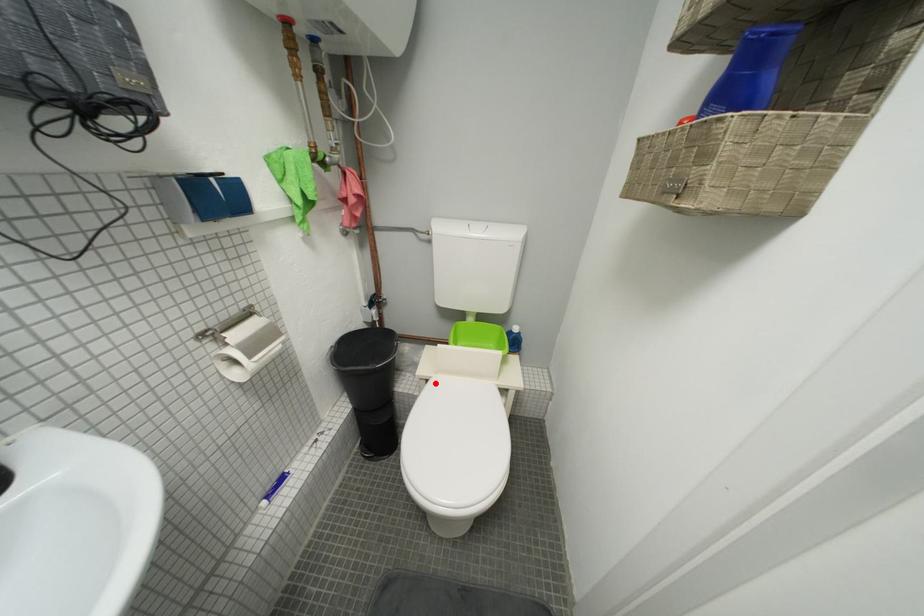
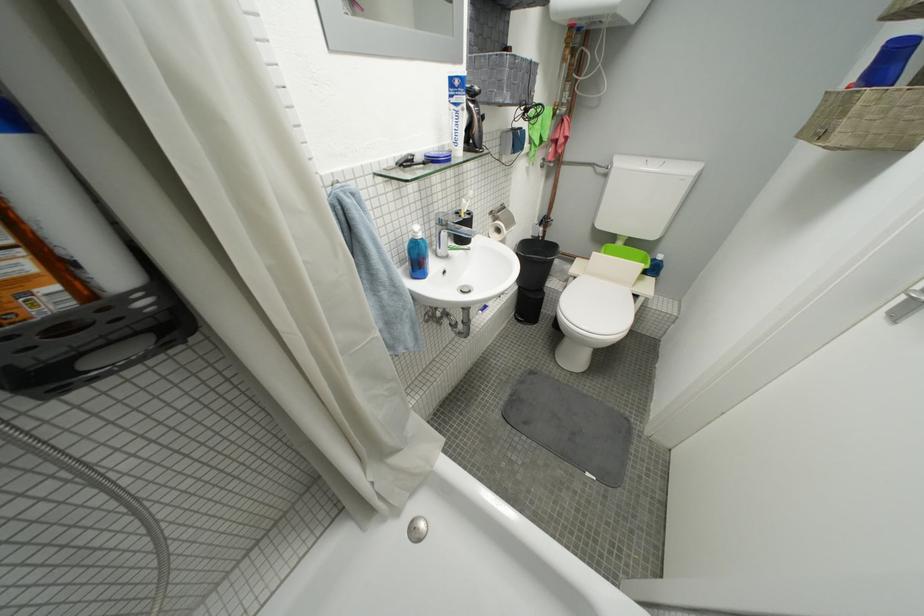
Locate, in the second image, the point that corresponds to the highlighted location in the first image.

(584, 281)